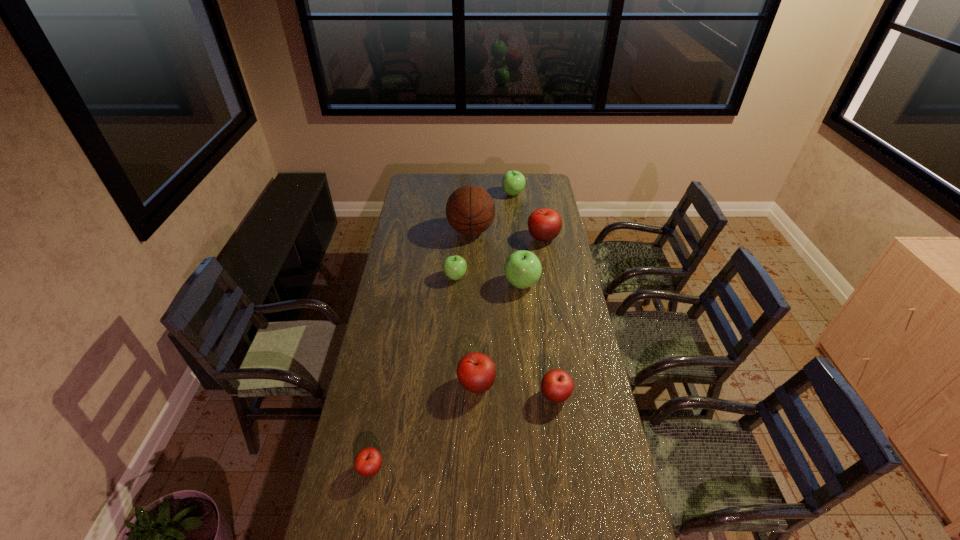
This screenshot has width=960, height=540. I want to click on free space that is in between the second red apple from left to right and the sixth nearest apple, so click(510, 312).

Find the location of a particular element. vacant area that lies between the second biggest green apple and the leftmost object is located at coordinates (442, 331).

The height and width of the screenshot is (540, 960). Find the location of `vacant point located between the sixth nearest apple and the smallest red apple`. vacant point located between the sixth nearest apple and the smallest red apple is located at coordinates (457, 354).

Where is `vacant area that lies between the second biggest red apple and the leftmost green apple`? The height and width of the screenshot is (540, 960). vacant area that lies between the second biggest red apple and the leftmost green apple is located at coordinates (466, 330).

Find the location of a particular element. The image size is (960, 540). object that is the fifth closest to the biggest green apple is located at coordinates (557, 385).

Identify which object is located as the seventh nearest to the basketball. Please provide its 2D coordinates. Your answer should be formatted as a tuple, i.e. [(x, y)], where the tuple contains the x and y coordinates of a point satisfying the conditions above.

[(368, 461)]

At what (x,y) coordinates should I click in order to perform the action: click on apple that is the third nearest to the second red apple from left to right. Please return your answer as a coordinate pair (x, y). Image resolution: width=960 pixels, height=540 pixels. Looking at the image, I should click on (522, 269).

The image size is (960, 540). In order to click on the sixth closest apple to the leftmost apple in this screenshot , I will do `click(513, 182)`.

This screenshot has width=960, height=540. What are the coordinates of `green apple that is the closest to the basketball` in the screenshot? It's located at (513, 182).

Where is `green apple that stands as the second closest to the biggest green apple`? The image size is (960, 540). green apple that stands as the second closest to the biggest green apple is located at coordinates pyautogui.click(x=513, y=182).